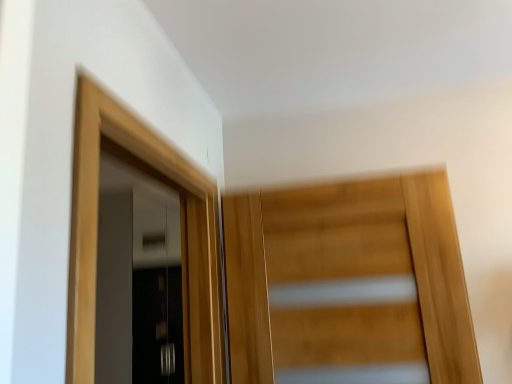
Question: From a real-world perspective, is wooden door at center, which is the 1th door in right-to-left order, physically above matte black door at left, marked as the 3th door in a right-to-left arrangement?

Choices:
 (A) yes
 (B) no

Answer: (A)

Question: Can you confirm if wooden door at center, positioned as the 2th door in front-to-back order, is smaller than matte black door at left, marked as the 3th door in a right-to-left arrangement?

Choices:
 (A) no
 (B) yes

Answer: (B)

Question: From the image's perspective, would you say wooden door at center, the 3th door viewed from the left, is positioned over matte black door at left, which is the third door from front to back?

Choices:
 (A) yes
 (B) no

Answer: (A)

Question: Can you confirm if wooden door at center, which is the 1th door in right-to-left order, is positioned to the right of matte black door at left, which ranks as the first door in back-to-front order?

Choices:
 (A) no
 (B) yes

Answer: (B)

Question: From the image's perspective, is wooden door at center, the 2th door from the back, under matte black door at left, the 1th door when ordered from left to right?

Choices:
 (A) yes
 (B) no

Answer: (B)

Question: Considering the relative positions of wooden door at center, positioned as the 2th door in front-to-back order, and light wood door at upper left, marked as the 2th door in a right-to-left arrangement, in the image provided, is wooden door at center, positioned as the 2th door in front-to-back order, to the left or to the right of light wood door at upper left, marked as the 2th door in a right-to-left arrangement,?

Choices:
 (A) left
 (B) right

Answer: (B)

Question: From a real-world perspective, is wooden door at center, positioned as the 2th door in front-to-back order, positioned above or below light wood door at upper left, marked as the 2th door in a right-to-left arrangement?

Choices:
 (A) above
 (B) below

Answer: (B)

Question: Relative to light wood door at upper left, which appears as the 3th door when viewed from the back, is wooden door at center, positioned as the 2th door in front-to-back order, in front or behind?

Choices:
 (A) front
 (B) behind

Answer: (B)

Question: From the image's perspective, is wooden door at center, the 3th door viewed from the left, positioned above or below light wood door at upper left, which appears as the 3th door when viewed from the back?

Choices:
 (A) below
 (B) above

Answer: (A)

Question: In terms of height, does light wood door at upper left, which is the 2th door from left to right, look taller or shorter compared to matte black door at left, which ranks as the first door in back-to-front order?

Choices:
 (A) short
 (B) tall

Answer: (A)

Question: From the image's perspective, is light wood door at upper left, the 1th door viewed from the front, positioned above or below matte black door at left, marked as the 3th door in a right-to-left arrangement?

Choices:
 (A) above
 (B) below

Answer: (A)

Question: Looking at the image, does light wood door at upper left, which is the 2th door from left to right, seem bigger or smaller compared to matte black door at left, the 1th door when ordered from left to right?

Choices:
 (A) big
 (B) small

Answer: (B)

Question: Relative to matte black door at left, which ranks as the first door in back-to-front order, is light wood door at upper left, which is the 2th door from left to right, in front or behind?

Choices:
 (A) front
 (B) behind

Answer: (A)

Question: Does point (396, 340) appear closer or farther from the camera than point (117, 167)?

Choices:
 (A) farther
 (B) closer

Answer: (B)

Question: Relative to matte black door at left, marked as the 3th door in a right-to-left arrangement, is wooden door at center, which is the 1th door in right-to-left order, in front or behind?

Choices:
 (A) front
 (B) behind

Answer: (A)